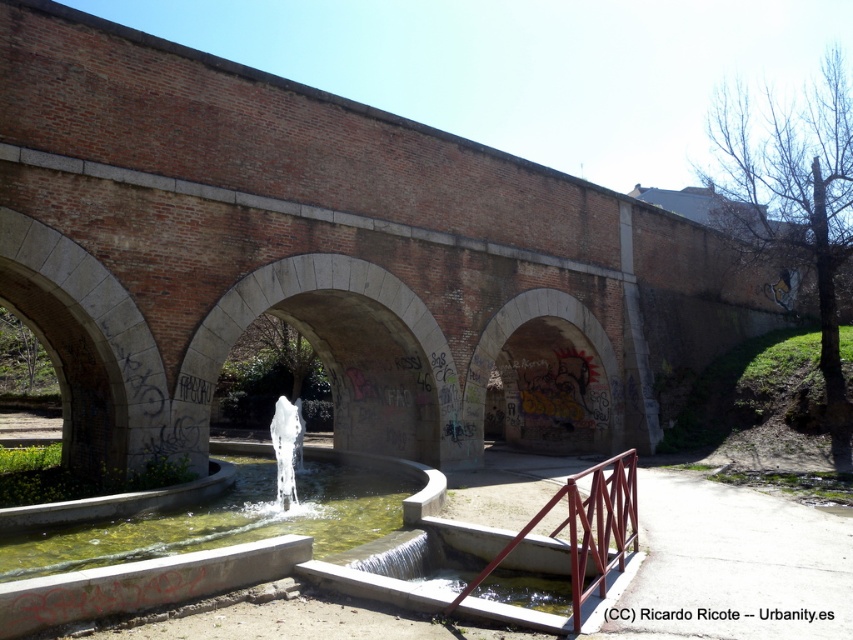
Is clear concrete water at center in front of metallic red railing at lower center?

No, clear concrete water at center is behind metallic red railing at lower center.

Who is positioned more to the right, clear concrete water at center or metallic red railing at lower center?

metallic red railing at lower center

Which is in front, point (99, 547) or point (602, 547)?

Point (602, 547) is more forward.

Identify the location of clear concrete water at center. (231, 516).